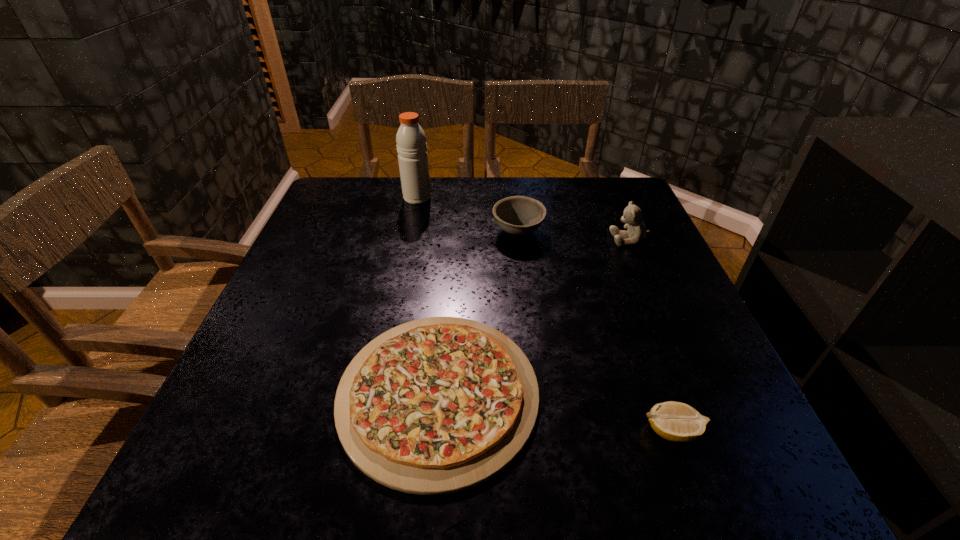
You are a GUI agent. You are given a task and a screenshot of the screen. Output one action in this format:
    pyautogui.click(x=<x>, y=<y>)
    Task: Click on the unoccupied area between the pizza and the farthest object
    The image size is (960, 540).
    Given the screenshot: What is the action you would take?
    pyautogui.click(x=428, y=295)

You are a GUI agent. You are given a task and a screenshot of the screen. Output one action in this format:
    pyautogui.click(x=<x>, y=<y>)
    Task: Click on the vacant space in between the tallest object and the lemon
    The height and width of the screenshot is (540, 960).
    Given the screenshot: What is the action you would take?
    pyautogui.click(x=544, y=314)

Where is `free spot between the shortest object and the third tallest object`? The height and width of the screenshot is (540, 960). free spot between the shortest object and the third tallest object is located at coordinates (478, 313).

Find the location of a particular element. free space between the shortest object and the fourth tallest object is located at coordinates (555, 412).

Locate an element on the screen. This screenshot has height=540, width=960. vacant point located between the pizza and the teddy bear is located at coordinates (534, 316).

Find the location of a particular element. The width and height of the screenshot is (960, 540). the third closest object to the lemon is located at coordinates (517, 215).

At what (x,y) coordinates should I click in order to perform the action: click on object that is the second closest one to the farthest object. Please return your answer as a coordinate pair (x, y). Image resolution: width=960 pixels, height=540 pixels. Looking at the image, I should click on (435, 406).

You are a GUI agent. You are given a task and a screenshot of the screen. Output one action in this format:
    pyautogui.click(x=<x>, y=<y>)
    Task: Click on the vacant region that satisfies the following two spatial constraints: 1. on the front side of the pizza; 2. on the left side of the farthest object
    The height and width of the screenshot is (540, 960).
    Given the screenshot: What is the action you would take?
    pyautogui.click(x=377, y=394)

This screenshot has height=540, width=960. What are the coordinates of `free space in the image that satisfies the following two spatial constraints: 1. on the back side of the bowl; 2. on the right side of the pizza` in the screenshot? It's located at (452, 232).

The height and width of the screenshot is (540, 960). Find the location of `vacant position in the image that satisfies the following two spatial constraints: 1. on the face of the teddy bear; 2. on the front side of the fourth tallest object`. vacant position in the image that satisfies the following two spatial constraints: 1. on the face of the teddy bear; 2. on the front side of the fourth tallest object is located at coordinates (711, 431).